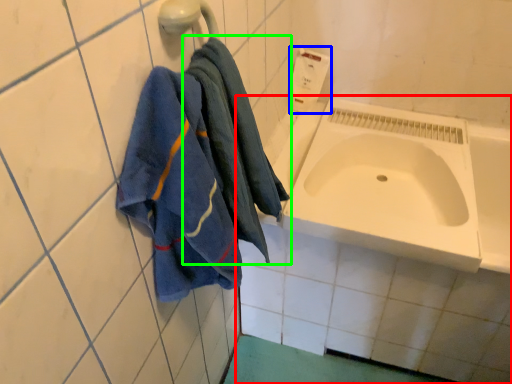
Question: Estimate the real-world distances between objects in this image. Which object is closer to bath (highlighted by a red box), soap dispenser (highlighted by a blue box) or towel (highlighted by a green box)?

Choices:
 (A) soap dispenser
 (B) towel

Answer: (B)